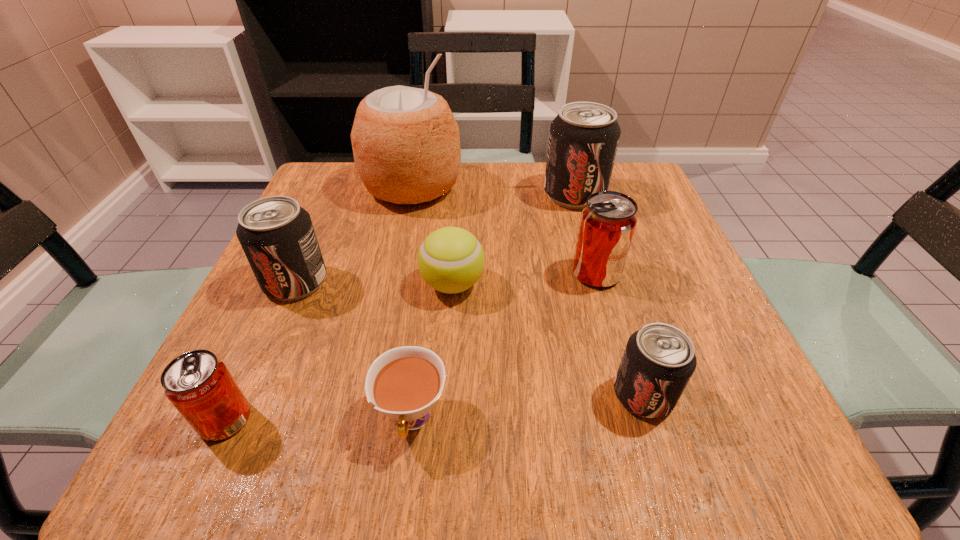
Where is `free space that is in between the nearest black soda can and the coconut`? free space that is in between the nearest black soda can and the coconut is located at coordinates (528, 291).

Find the location of a particular element. vacant point located between the tallest object and the bigger red pop soda is located at coordinates (504, 230).

At what (x,y) coordinates should I click in order to perform the action: click on vacant space that is in between the smallest black soda can and the tennis ball. Please return your answer as a coordinate pair (x, y). The height and width of the screenshot is (540, 960). Looking at the image, I should click on (548, 340).

Find the location of a particular element. The width and height of the screenshot is (960, 540). free space between the tallest object and the nearest black soda can is located at coordinates (528, 291).

I want to click on the closest object relative to the coconut, so click(x=277, y=236).

Locate an element on the screen. object that is the seventh closest to the coconut is located at coordinates tap(659, 359).

Where is `pop soda that stands as the second closest to the smaller red pop soda`? This screenshot has height=540, width=960. pop soda that stands as the second closest to the smaller red pop soda is located at coordinates (659, 359).

Identify which pop soda is the third nearest to the farthest black soda can. Please provide its 2D coordinates. Your answer should be formatted as a tuple, i.e. [(x, y)], where the tuple contains the x and y coordinates of a point satisfying the conditions above.

[(277, 236)]

At what (x,y) coordinates should I click in order to perform the action: click on the third closest black soda can to the teacup. Please return your answer as a coordinate pair (x, y). Looking at the image, I should click on (584, 136).

Locate an element on the screen. The height and width of the screenshot is (540, 960). the second closest black soda can to the smallest black soda can is located at coordinates (277, 236).